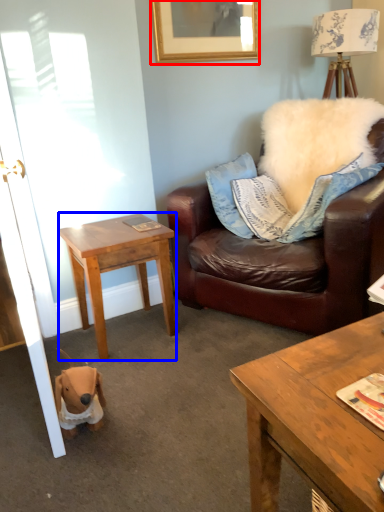
Question: Among these objects, which one is nearest to the camera, picture frame (highlighted by a red box) or desk (highlighted by a blue box)?

Choices:
 (A) picture frame
 (B) desk

Answer: (B)